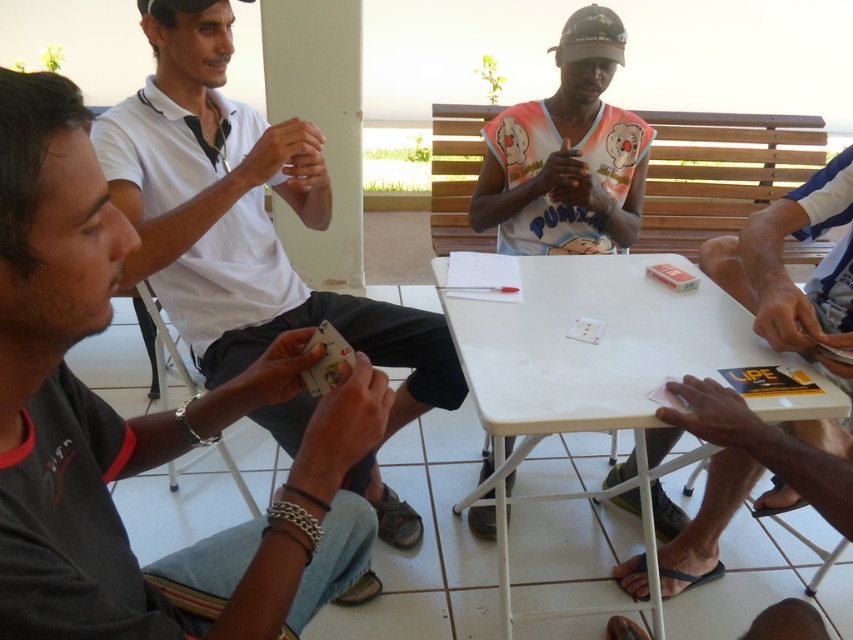
You are a photographer trying to capture a closeup of the pink matte card at lower right without including the white sleeveless shirt at center in the shot. Given their relative heights, can you position yourself in a way that allows this?

The white sleeveless shirt at center has a lesser height compared to the pink matte card at lower right. Therefore, by positioning the camera lower to the ground, you can focus on the pink matte card at lower right while avoiding the taller card in the frame.

Looking at this image, you are standing 5 feet away from the point at coordinates point (706, 340). Can you reach it without moving your feet?

The distance of point (706, 340) from viewer is 4.63 feet, so yes, you can reach it without moving your feet since it is closer than 5 feet.

You are standing at the camera position and want to throw a small object to a point that is 4.10 feet away. Is the point at coordinates point (525, 385) within that distance?

The distance of point (525, 385) from camera is 4.10 feet, so yes, the point at coordinates point (525, 385) is exactly 4.10 feet away from the camera.